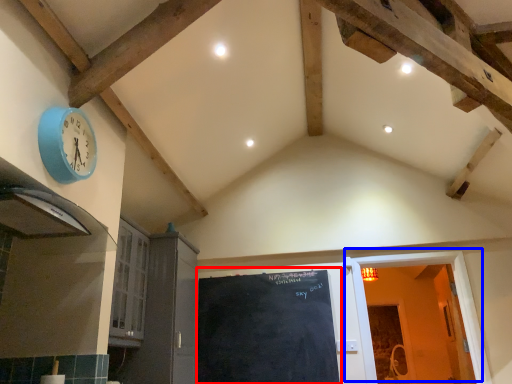
Question: Which of the following is the closest to the observer, bulletin board (highlighted by a red box) or door (highlighted by a blue box)?

Choices:
 (A) bulletin board
 (B) door

Answer: (B)